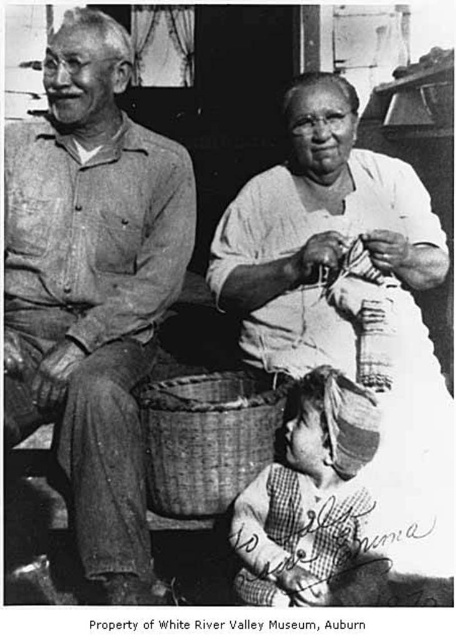
Question: Which of these objects is positioned farthest from the denim shirt at left?

Choices:
 (A) woven bamboo basket at lower center
 (B) plaid fabric dress at lower right
 (C) white cotton dress at center

Answer: (B)

Question: In this image, where is denim shirt at left located relative to plaid fabric dress at lower right?

Choices:
 (A) right
 (B) left

Answer: (B)

Question: Estimate the real-world distances between objects in this image. Which object is closer to the plaid fabric dress at lower right?

Choices:
 (A) woven bamboo basket at lower center
 (B) white cotton dress at center

Answer: (B)

Question: Does white cotton dress at center appear on the left side of woven bamboo basket at lower center?

Choices:
 (A) no
 (B) yes

Answer: (A)

Question: Is white cotton dress at center behind denim shirt at left?

Choices:
 (A) no
 (B) yes

Answer: (A)

Question: Which object is the closest to the denim shirt at left?

Choices:
 (A) white cotton dress at center
 (B) plaid fabric dress at lower right

Answer: (A)